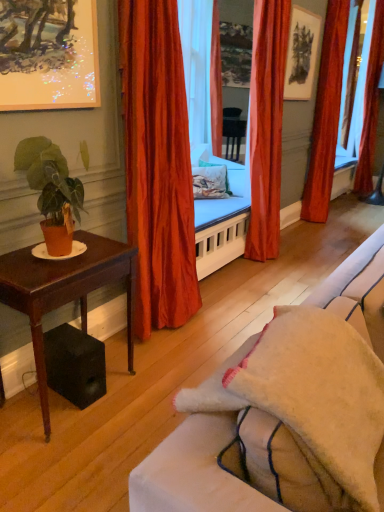
Identify the location of vacant region below matte orange pot at left (from a real-world perspective). Image resolution: width=384 pixels, height=512 pixels. click(x=60, y=258).